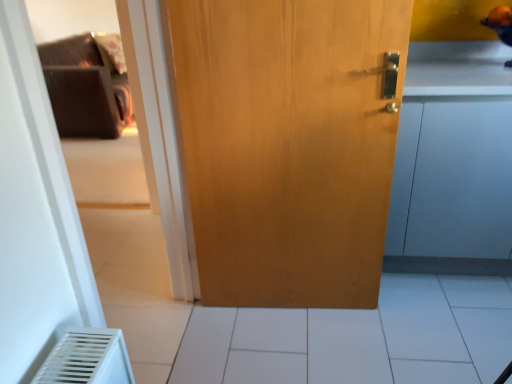
Question: Does light brown wood door at center appear on the right side of white tile at center?

Choices:
 (A) no
 (B) yes

Answer: (A)

Question: Is light brown wood door at center bigger than white tile at center?

Choices:
 (A) yes
 (B) no

Answer: (B)

Question: Are light brown wood door at center and white tile at center beside each other?

Choices:
 (A) yes
 (B) no

Answer: (B)

Question: Would you consider light brown wood door at center to be distant from white tile at center?

Choices:
 (A) yes
 (B) no

Answer: (B)

Question: Is white tile at center surrounded by light brown wood door at center?

Choices:
 (A) yes
 (B) no

Answer: (B)

Question: From the image's perspective, is light brown wood door at center over white tile at center?

Choices:
 (A) no
 (B) yes

Answer: (B)

Question: Is matte wood cabinet at right outside of white tile at center?

Choices:
 (A) yes
 (B) no

Answer: (A)

Question: Does matte wood cabinet at right have a greater height compared to white tile at center?

Choices:
 (A) yes
 (B) no

Answer: (A)

Question: Is the depth of matte wood cabinet at right less than that of white tile at center?

Choices:
 (A) yes
 (B) no

Answer: (B)

Question: Are matte wood cabinet at right and white tile at center far apart?

Choices:
 (A) no
 (B) yes

Answer: (A)

Question: Is matte wood cabinet at right aimed at white tile at center?

Choices:
 (A) yes
 (B) no

Answer: (B)

Question: From the image's perspective, is matte wood cabinet at right beneath white tile at center?

Choices:
 (A) yes
 (B) no

Answer: (B)

Question: Is white tile at center not within light brown wood door at center?

Choices:
 (A) yes
 (B) no

Answer: (A)